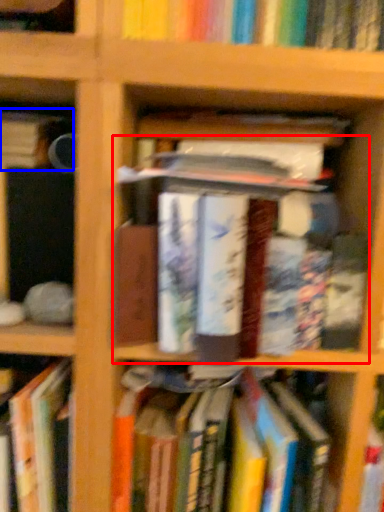
Question: Which object is closer to the camera taking this photo, book (highlighted by a red box) or book (highlighted by a blue box)?

Choices:
 (A) book
 (B) book

Answer: (A)